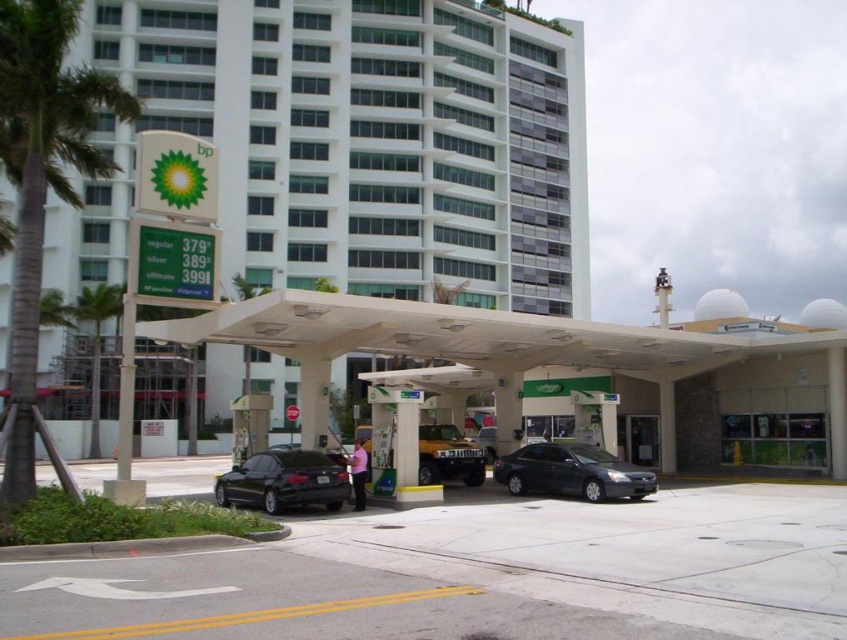
In the scene shown: You are driving a car that is 1.8 meters wide and want to park at the BP gas station. You see the shiny black sedan at lower left and the metallic gold suv at center. Which parking spot can you fit into based on their widths?

The shiny black sedan at lower left is thinner than metallic gold suv at center, so the parking spot for the shiny black sedan at lower left is narrower. Since your car is 1.8 meters wide, you should choose the parking spot for the metallic gold suv at center as it is wider and can accommodate your car.

You are standing next to the camera and want to fill up your car, which is the shiny black sedan at lower left. The gas station has a rule that you must stay within 15 meters of your car while pumping gas. Are you allowed to stay at the camera location while filling up?

The distance between you at the camera and the shiny black sedan at lower left is 16.66 meters. Since the rule requires staying within 15 meters, you are too far away to comply with the gas station policy.

You are a photographer trying to capture the entire white smooth building at upper center and the shiny black sedan at lower left in a single frame. Based on their sizes in the image, which object will appear larger in your photo?

The white smooth building at upper center will appear larger in the photo because it is bigger than the shiny black sedan at lower left according to the description.